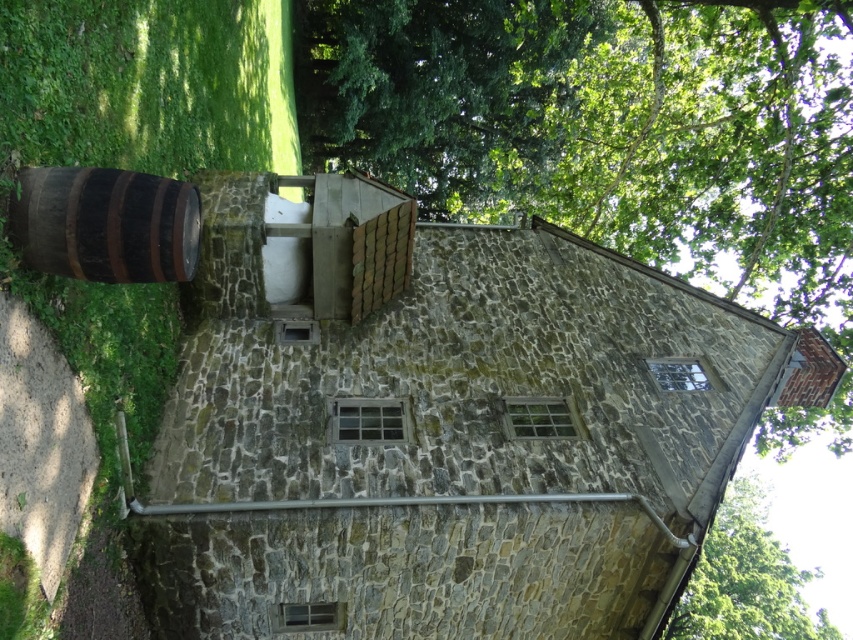
You are standing in front of the stone building and notice two barrels on the left side. Which one is positioned further to the left between the brown wooden barrel at left and the rustic wooden barrel at left?

The brown wooden barrel at left is positioned further to the left compared to the rustic wooden barrel at left.

You are standing in front of the stone building and want to place a new bench between the brown wooden barrel at left and the green leafy tree at upper right. Which object should you position the bench closer to if you want it to be nearer to the tree?

You should position the bench closer to the green leafy tree at upper right because the brown wooden barrel at left is already to the left of the green leafy tree at upper right, meaning the tree is further to the right. Placing the bench near the tree would make it closer to the desired location.

You are standing in front of the stone building and want to place a new flowerpot between the brown wooden barrel at left and the green leafy tree at upper right. Which object should the flowerpot be closer to if it needs to be placed near the smaller object?

The flowerpot should be placed closer to the brown wooden barrel at left because it is smaller than the green leafy tree at upper right.